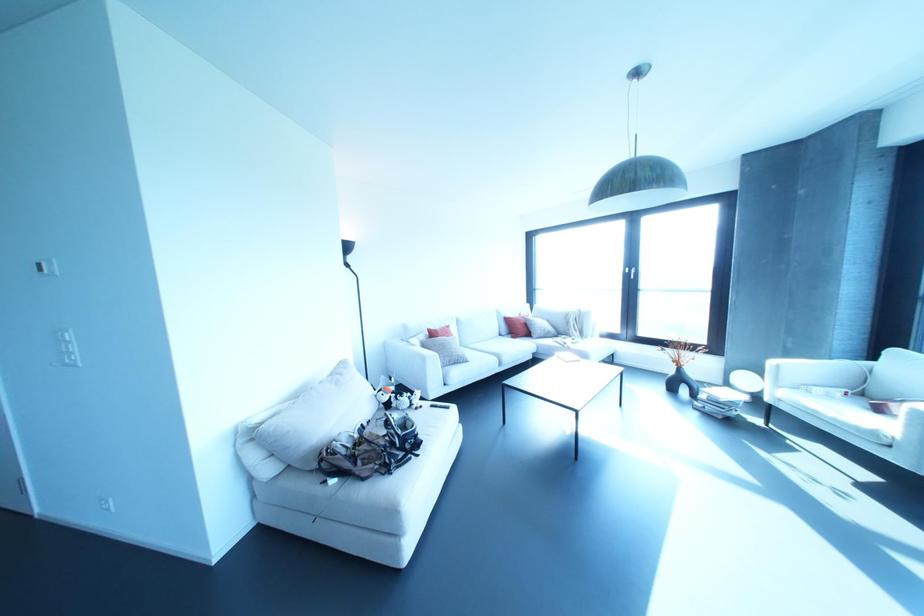
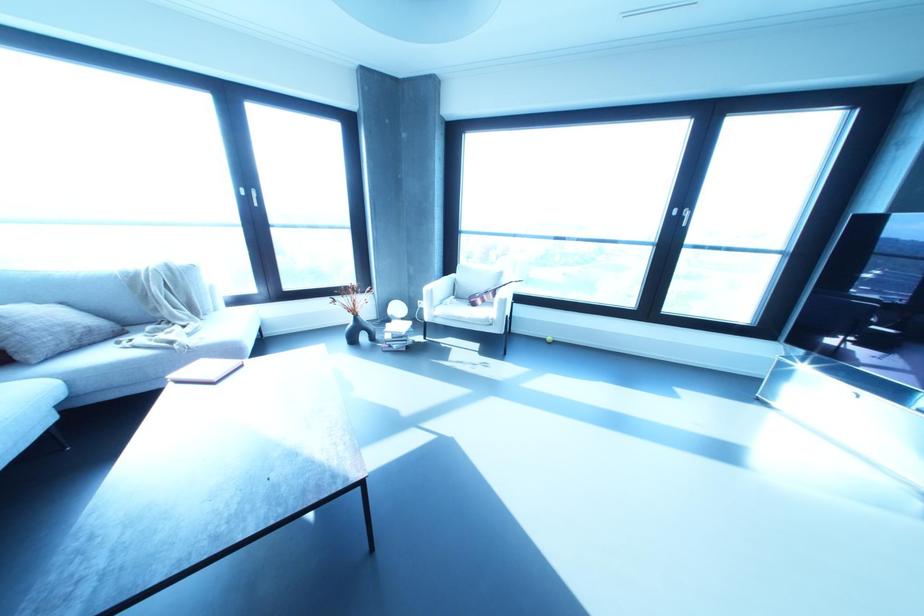
The point at [548,331] is marked in the first image. Where is the corresponding point in the second image?

(90, 330)